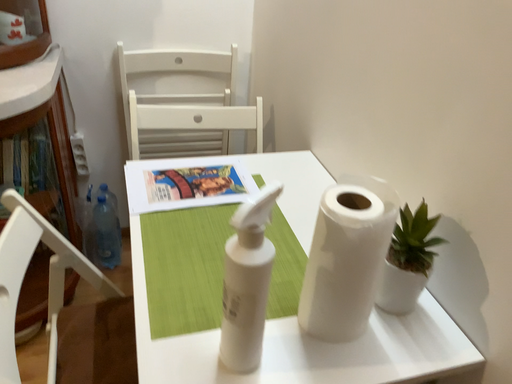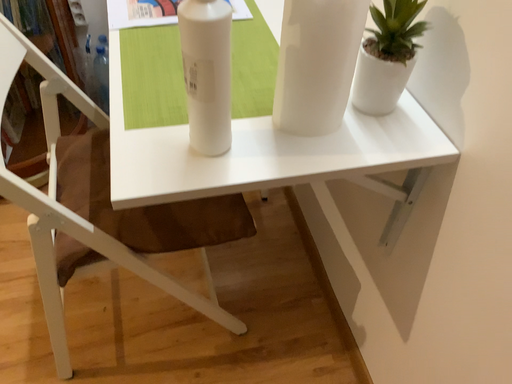
Question: How did the camera likely rotate when shooting the video?

Choices:
 (A) rotated downward
 (B) rotated upward

Answer: (A)